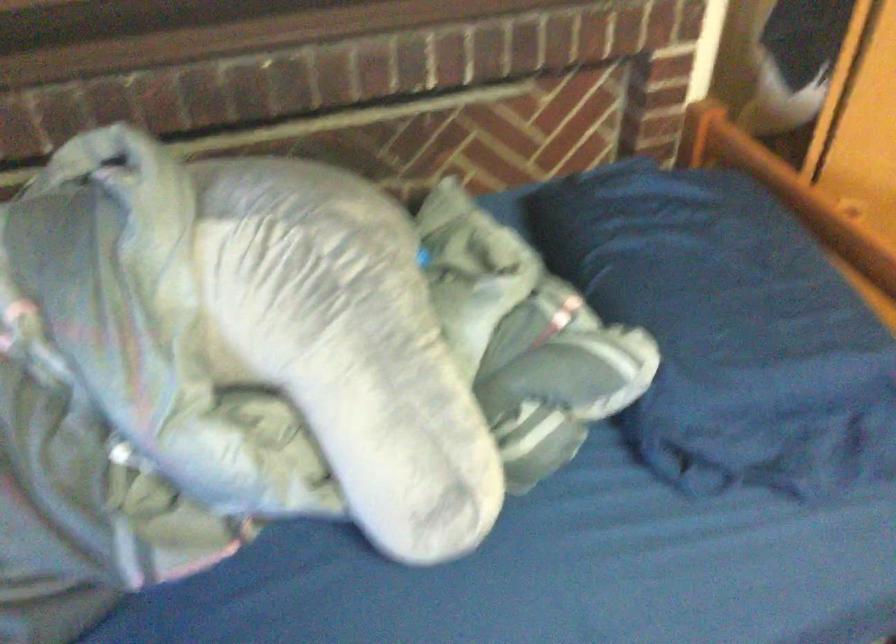
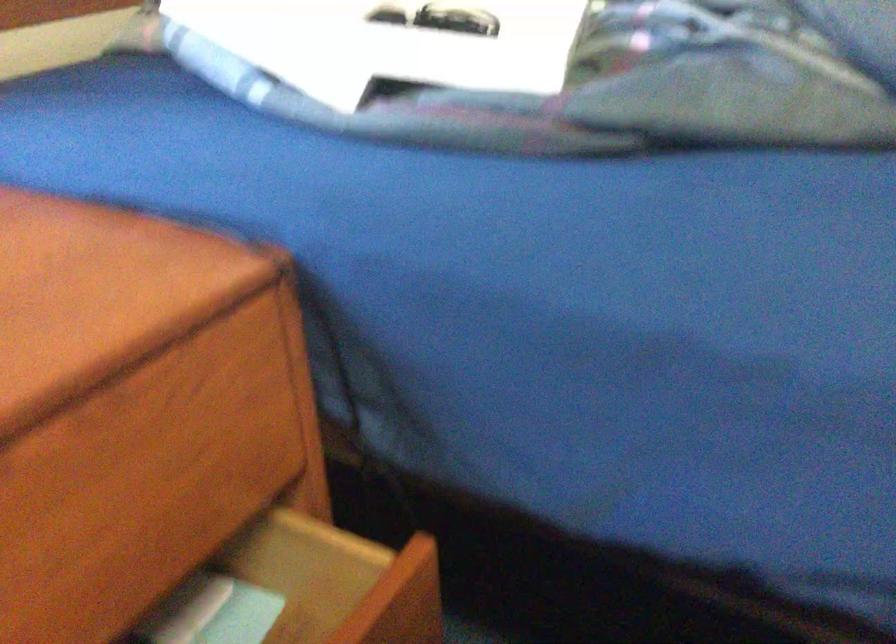
Question: How did the camera likely rotate?

Choices:
 (A) Left
 (B) Right
 (C) Up
 (D) Down

Answer: (A)